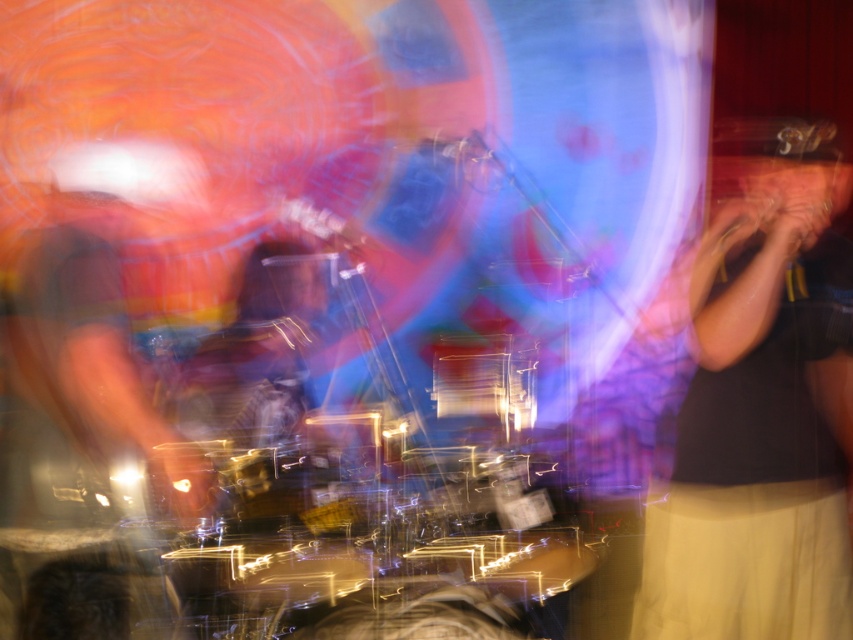
Question: From the image, what is the correct spatial relationship of black fabric shirt at right in relation to clear plastic drum at center?

Choices:
 (A) left
 (B) right

Answer: (B)

Question: Can you confirm if black fabric shirt at right is thinner than clear plastic drum at center?

Choices:
 (A) no
 (B) yes

Answer: (A)

Question: Which point is closer to the camera taking this photo?

Choices:
 (A) (679, 412)
 (B) (509, 371)

Answer: (A)

Question: Is black fabric shirt at right wider than clear plastic drum at center?

Choices:
 (A) no
 (B) yes

Answer: (B)